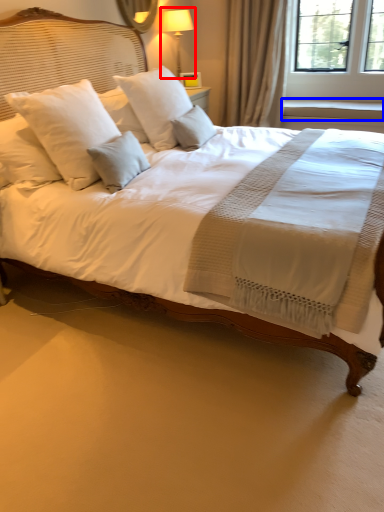
Question: Which point is closer to the camera, bedside lamp (highlighted by a red box) or window sill (highlighted by a blue box)?

Choices:
 (A) bedside lamp
 (B) window sill

Answer: (A)